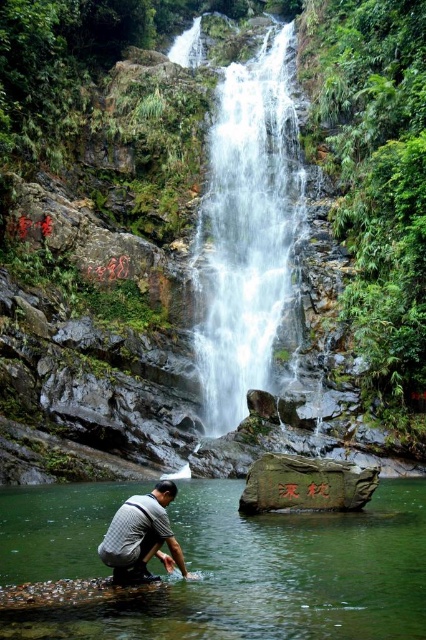
Can you confirm if clear water at center is thinner than gray fabric shirt at lower center?

No, clear water at center is not thinner than gray fabric shirt at lower center.

Which of these two, clear water at center or gray fabric shirt at lower center, stands shorter?

Standing shorter between the two is gray fabric shirt at lower center.

Where is `clear water at center`? Image resolution: width=426 pixels, height=640 pixels. clear water at center is located at coordinates (247, 230).

Between clear water at lower center and clear water at center, which one appears on the left side from the viewer's perspective?

Positioned to the left is clear water at center.

Is clear water at lower center taller than clear water at center?

In fact, clear water at lower center may be shorter than clear water at center.

Is point (215, 518) in front of point (250, 364)?

Yes, point (215, 518) is in front of point (250, 364).

The image size is (426, 640). Find the location of `clear water at lower center`. clear water at lower center is located at coordinates (270, 576).

Is clear water at lower center smaller than gray fabric shirt at lower center?

Incorrect, clear water at lower center is not smaller in size than gray fabric shirt at lower center.

Can you confirm if clear water at lower center is wider than gray fabric shirt at lower center?

Correct, the width of clear water at lower center exceeds that of gray fabric shirt at lower center.

Who is more distant from viewer, (170, 611) or (155, 532)?

The point (155, 532) is more distant.

The height and width of the screenshot is (640, 426). Identify the location of clear water at lower center. (270, 576).